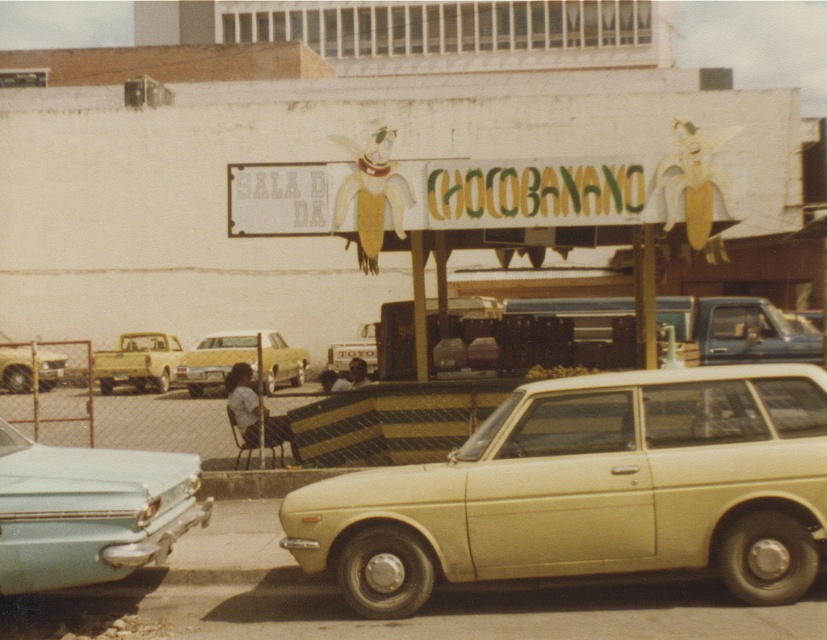
You are a delivery person who needs to park a 2.5 meter wide truck. There is a yellow matte car at center and a light yellow car at left. Which parking spot between them is wide enough for your truck?

The yellow matte car at center is wider than the light yellow car at left, so the parking spot between them might be wide enough for your truck if it is positioned next to the wider car.

You are a delivery driver who needs to park your 1.8 meters tall delivery van. You see a beige matte station wagon at center and a matte yellow truck at left. Which vehicle is shorter and can allow your van to park in the available space?

The beige matte station wagon at center is shorter than the matte yellow truck at left, so it can allow your van to park in the available space.

Based on the scene description, what object is located at the coordinates point (88, 512)?

The point (88, 512) marks the location of the light blue metallic car at lower left.